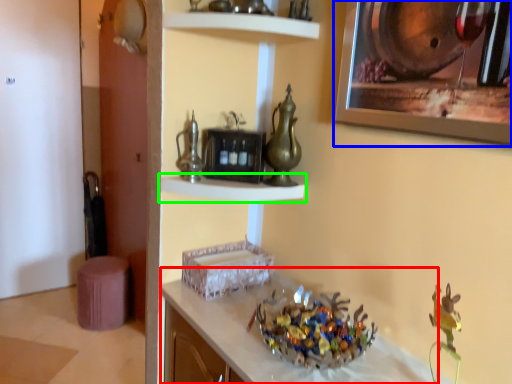
Question: Which object is positioned closest to counter (highlighted by a red box)? Select from picture frame (highlighted by a blue box) and shelf (highlighted by a green box).

Choices:
 (A) picture frame
 (B) shelf

Answer: (B)